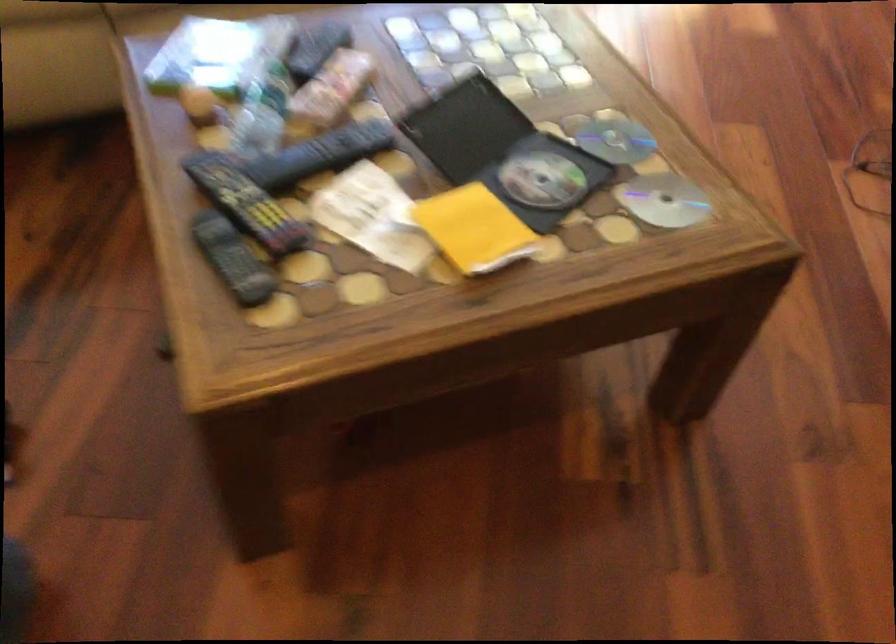
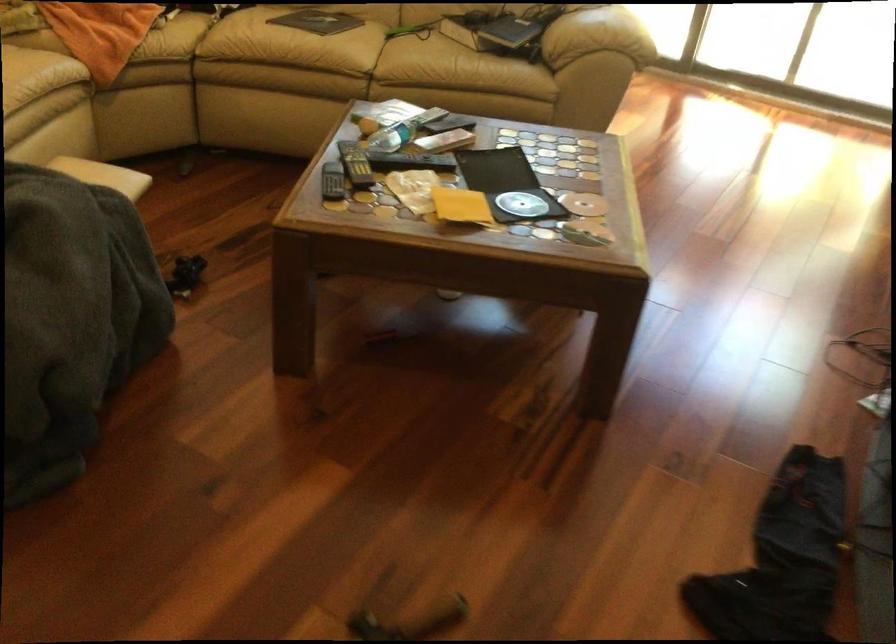
The point at (547, 184) is marked in the first image. Where is the corresponding point in the second image?

(521, 204)